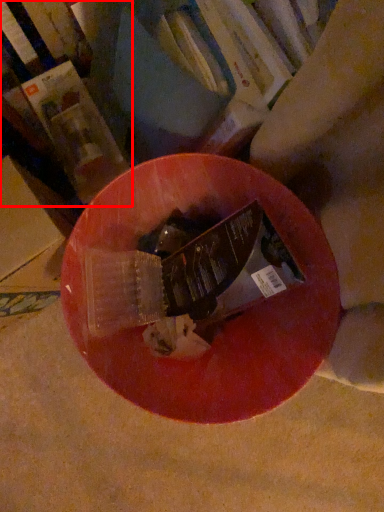
Question: From the image's perspective, considering the relative positions of book (annotated by the red box) and book in the image provided, where is book (annotated by the red box) located with respect to the staircase?

Choices:
 (A) below
 (B) above

Answer: (A)